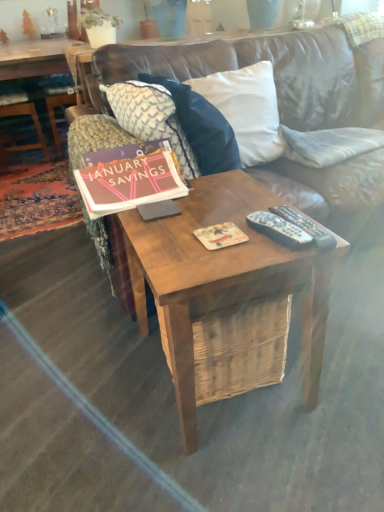
Find the location of a particular element. This screenshot has height=512, width=384. free space on the front side of woven brown basket at center is located at coordinates (245, 464).